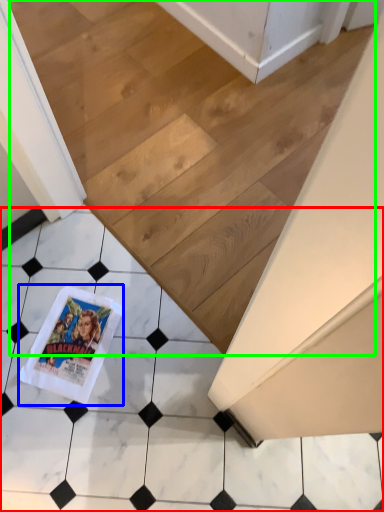
Question: Which object is the closest to the tile (highlighted by a red box)? Choose among these: comic book (highlighted by a blue box) or stairwell (highlighted by a green box).

Choices:
 (A) comic book
 (B) stairwell

Answer: (A)